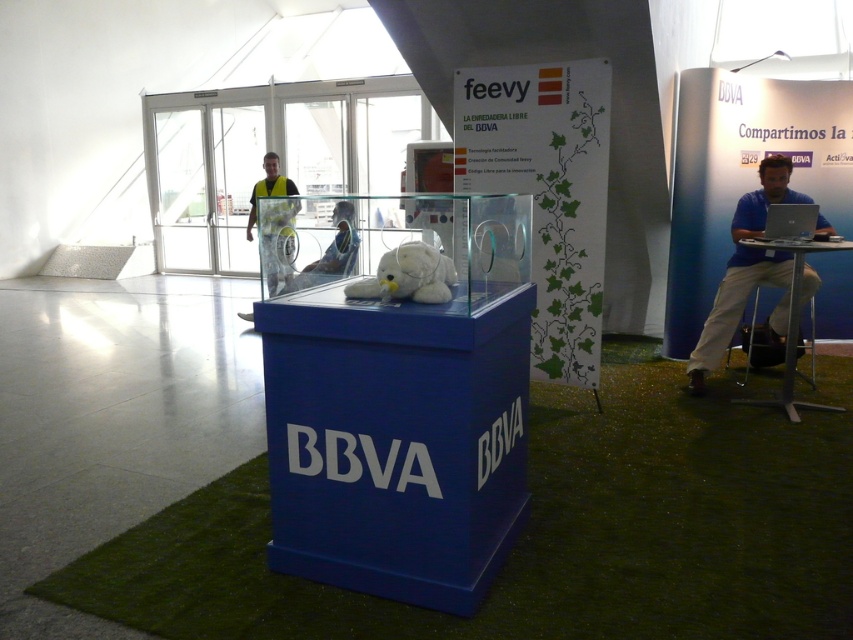
Question: Which object is farther from the camera taking this photo?

Choices:
 (A) white plush at center
 (B) blue cotton shirt at right
 (C) yellow reflective vest at center

Answer: (C)

Question: Which of these objects is positioned closest to the blue cotton shirt at right?

Choices:
 (A) yellow reflective vest at center
 (B) white plush at center

Answer: (B)

Question: Is blue cotton shirt at right above yellow reflective vest at center?

Choices:
 (A) no
 (B) yes

Answer: (A)

Question: Does blue cotton shirt at right appear on the right side of white plush at center?

Choices:
 (A) no
 (B) yes

Answer: (B)

Question: Does blue cotton shirt at right appear on the right side of yellow reflective vest at center?

Choices:
 (A) yes
 (B) no

Answer: (A)

Question: Which object is closer to the camera taking this photo?

Choices:
 (A) blue cotton shirt at right
 (B) yellow reflective vest at center
 (C) white plush at center

Answer: (C)